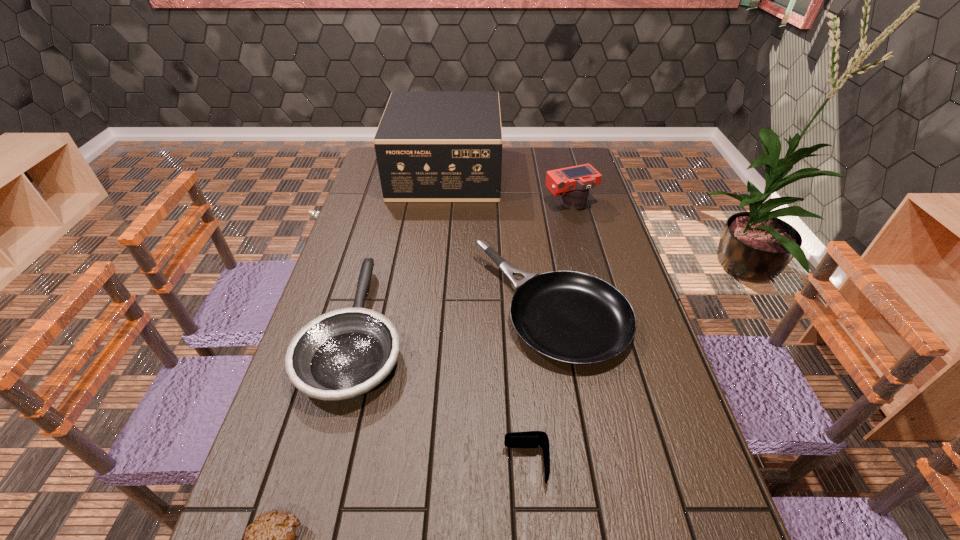
Identify the location of free space that satisfies the following two spatial constraints: 1. on the back side of the pan; 2. on the front-facing side of the tallest object. The height and width of the screenshot is (540, 960). (529, 173).

At what (x,y) coordinates should I click in order to perform the action: click on vacant space that satisfies the following two spatial constraints: 1. on the handle side of the frying pan; 2. on the right side of the camera. Please return your answer as a coordinate pair (x, y). Image resolution: width=960 pixels, height=540 pixels. Looking at the image, I should click on (391, 204).

Find the location of a particular element. This screenshot has width=960, height=540. free spot that satisfies the following two spatial constraints: 1. on the handle side of the pan; 2. on the right side of the frying pan is located at coordinates (363, 308).